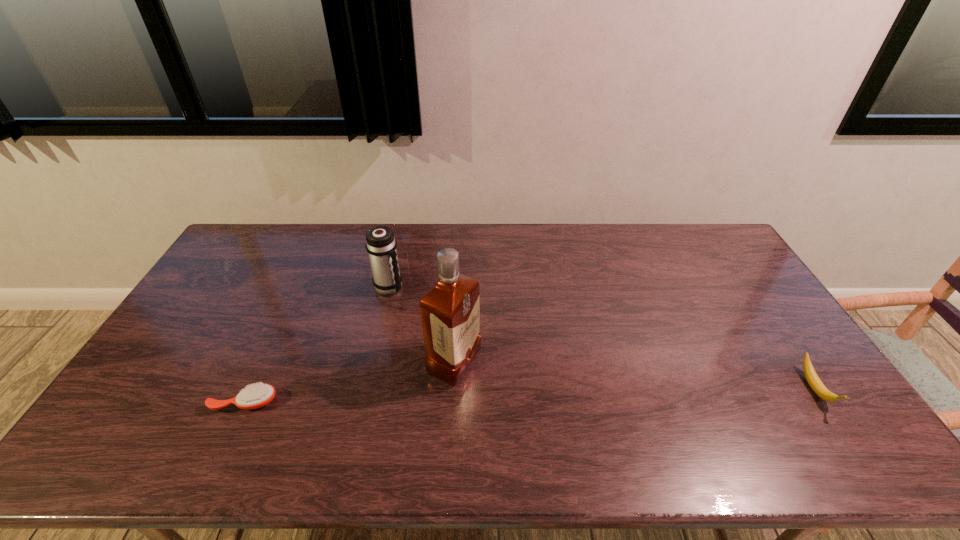
This screenshot has width=960, height=540. In order to click on vacant space on the desktop that is between the hairbrush and the rightmost object and is positioned on the front label of the tallest object in this screenshot , I will do `click(524, 396)`.

This screenshot has width=960, height=540. Identify the location of vacant space on the desktop that is between the hairbrush and the rightmost object and is positioned on the side with the handle of the farthest object. (606, 394).